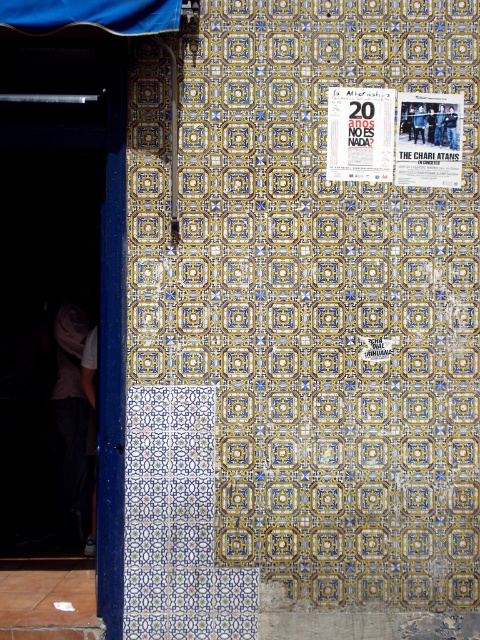
Question: Which object is positioned closest to the white paper poster at upper center?

Choices:
 (A) blue painted wood at left
 (B) matte paper poster at upper right

Answer: (B)

Question: Which is nearer to the blue painted wood at left?

Choices:
 (A) matte paper poster at upper right
 (B) white paper poster at upper center

Answer: (B)

Question: Observing the image, what is the correct spatial positioning of blue painted wood at left in reference to white paper poster at upper center?

Choices:
 (A) below
 (B) above

Answer: (A)

Question: Does white paper poster at upper center have a lesser width compared to matte paper poster at upper right?

Choices:
 (A) yes
 (B) no

Answer: (A)

Question: Which point is closer to the camera?

Choices:
 (A) (105, 579)
 (B) (371, 166)
 (C) (453, 164)

Answer: (A)

Question: Where is white paper poster at upper center located in relation to matte paper poster at upper right in the image?

Choices:
 (A) right
 (B) left

Answer: (B)